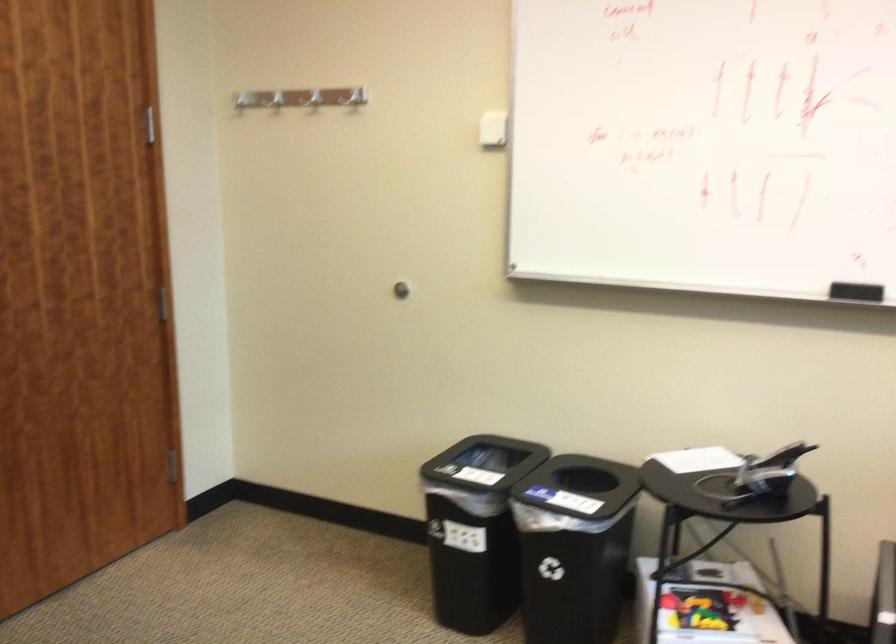
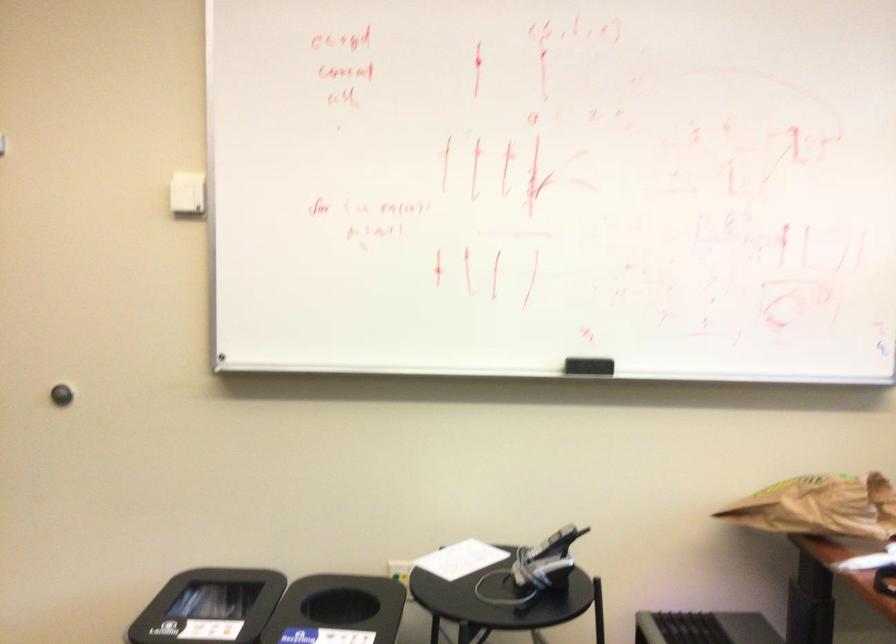
In the second image, find the point that corresponds to point (485, 138) in the first image.

(186, 194)